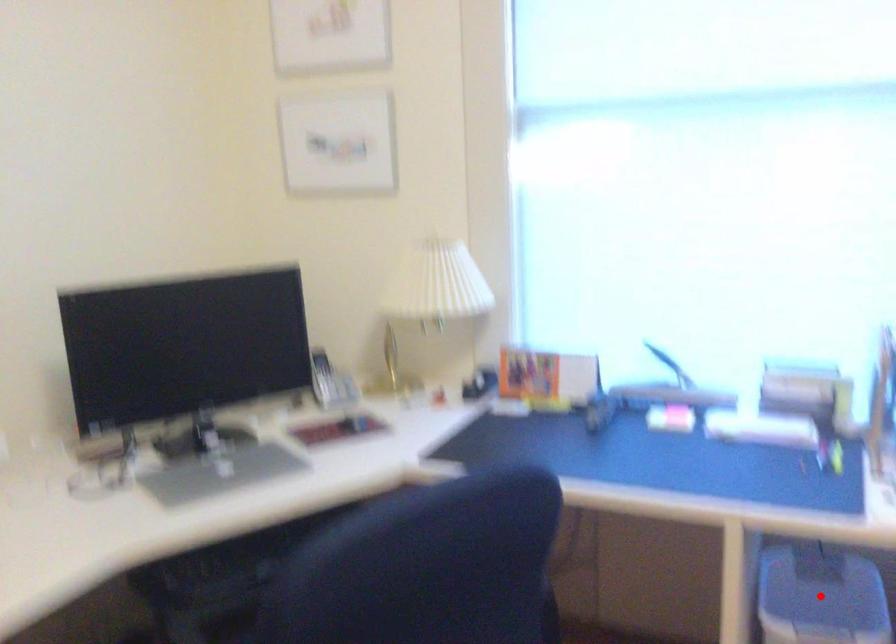
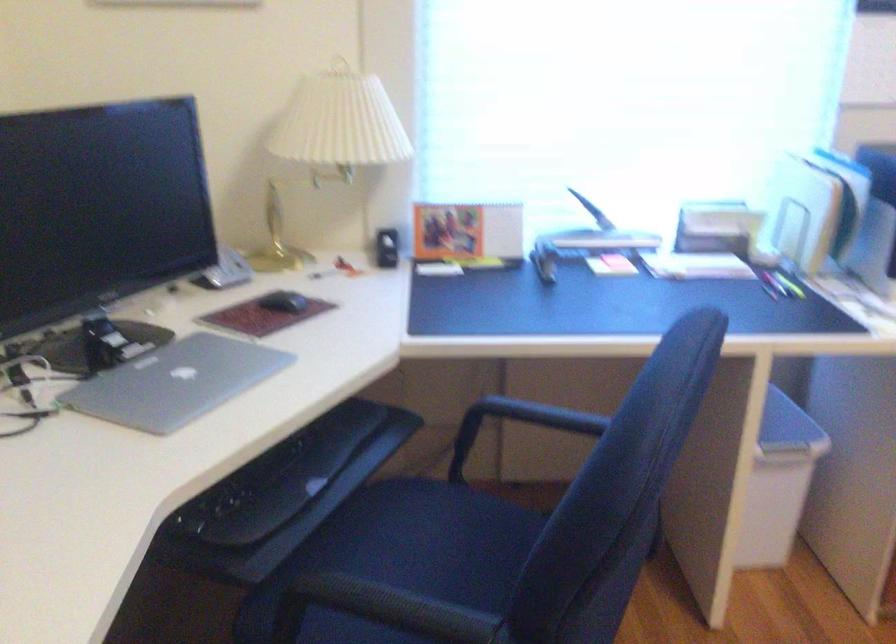
Question: I am providing you with two images of the same scene from different viewpoints. A red point is marked on the first image. At the location where the point appears in image 1, is it still visible in image 2?

Choices:
 (A) Yes
 (B) No

Answer: (B)